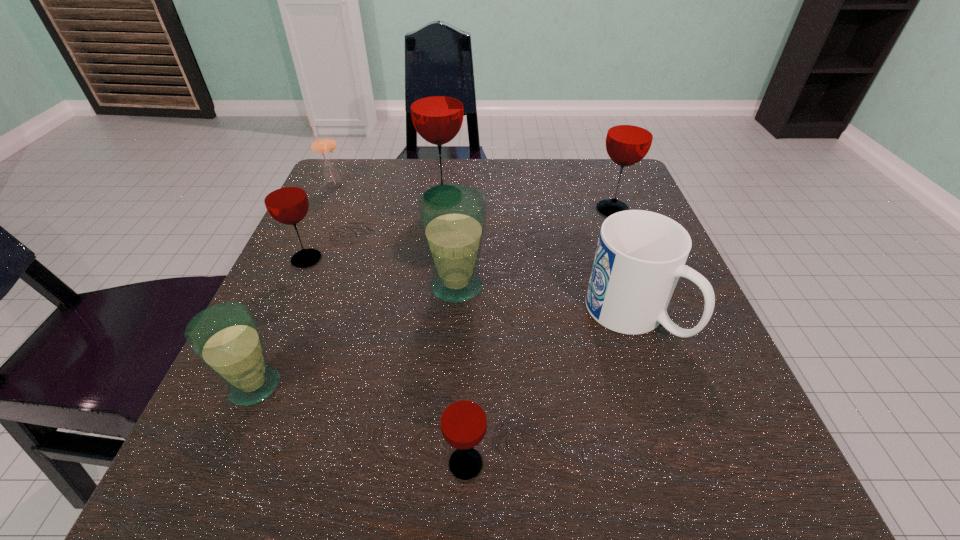
Where is `the smaller blue glass`? the smaller blue glass is located at coordinates (225, 337).

Where is `the nearer blue glass`? the nearer blue glass is located at coordinates (225, 337).

The height and width of the screenshot is (540, 960). I want to click on the smallest red glass, so click(x=463, y=420).

The width and height of the screenshot is (960, 540). Find the location of `the nearest red glass`. the nearest red glass is located at coordinates point(463,420).

Find the location of a particular element. This screenshot has width=960, height=540. free space located on the right of the tallest glass is located at coordinates (635, 197).

I want to click on free region located 0.070m on the front of the second biggest red glass, so click(625, 242).

Identify the location of vacant space located on the front of the leftmost red glass. (220, 458).

Locate an element on the screen. vacant space located 0.290m on the front of the farther blue glass is located at coordinates [445, 483].

Identify the location of vacant space situated 0.190m on the front of the straw. This screenshot has height=540, width=960. (307, 244).

This screenshot has width=960, height=540. What are the coordinates of `vacant space located 0.180m on the back of the mug` in the screenshot? It's located at 601,221.